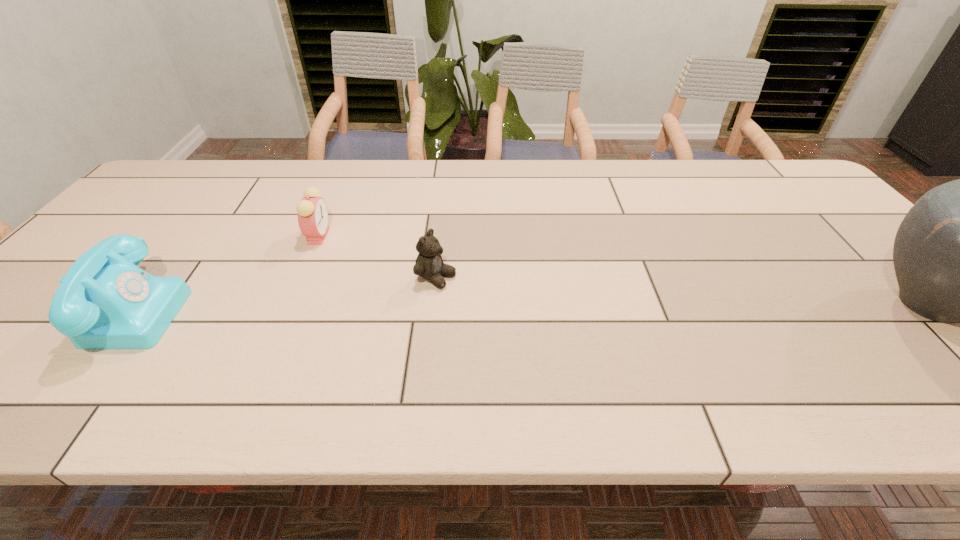
Where is `telephone`? telephone is located at coordinates pyautogui.click(x=105, y=301).

This screenshot has height=540, width=960. What are the coordinates of `the second tallest object` in the screenshot? It's located at (105, 301).

Image resolution: width=960 pixels, height=540 pixels. I want to click on alarm clock, so click(x=312, y=211).

Locate an element on the screen. The height and width of the screenshot is (540, 960). the third object from right to left is located at coordinates (312, 211).

At what (x,y) coordinates should I click in order to perform the action: click on teddy bear. Please return your answer as a coordinate pair (x, y). Image resolution: width=960 pixels, height=540 pixels. Looking at the image, I should click on (429, 264).

Image resolution: width=960 pixels, height=540 pixels. Find the location of `vacant area located on the dial of the telephone`. vacant area located on the dial of the telephone is located at coordinates (x=350, y=309).

The image size is (960, 540). Find the location of `free location located on the face of the farthest object`. free location located on the face of the farthest object is located at coordinates (341, 255).

Image resolution: width=960 pixels, height=540 pixels. What are the coordinates of `free space located on the face of the farthest object` in the screenshot? It's located at (419, 307).

Find the location of a particular element. Image resolution: width=960 pixels, height=540 pixels. free point located 0.110m on the face of the farthest object is located at coordinates (348, 260).

Identify the location of free space located on the face of the second object from right to left. (482, 295).